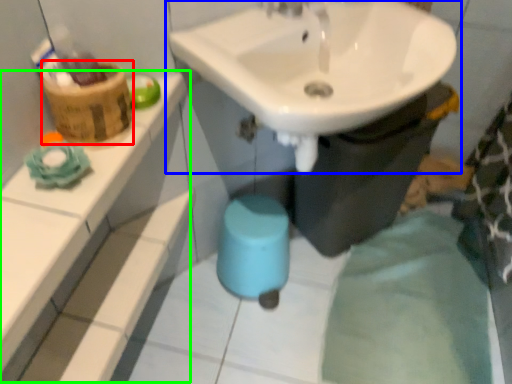
Question: Estimate the real-world distances between objects in this image. Which object is farther from basket (highlighted by a red box), sink (highlighted by a blue box) or balustrade (highlighted by a green box)?

Choices:
 (A) sink
 (B) balustrade

Answer: (A)